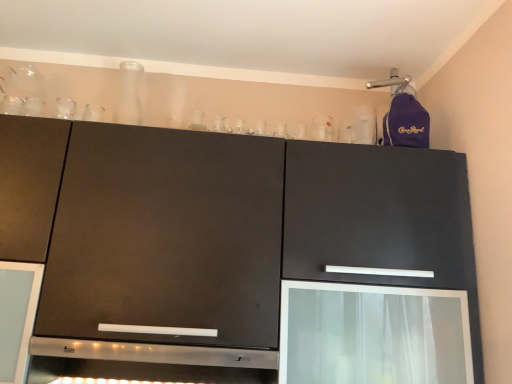
What are the coordinates of `blank space situated above transparent glass screen door at lower right (from a real-world perspective)` in the screenshot? It's located at (375, 282).